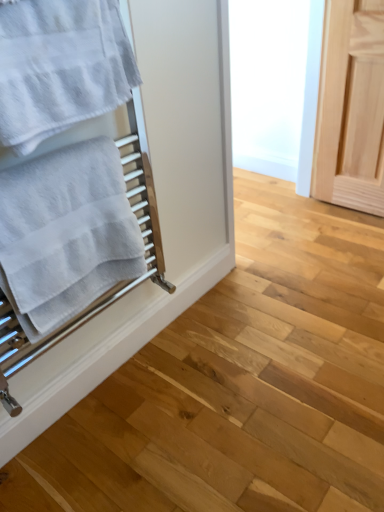
Question: Would you say white cotton towel at left, which is the 1th towel in bottom-to-top order, is inside or outside white textured towel at left, which ranks as the first towel in top-to-bottom order?

Choices:
 (A) inside
 (B) outside

Answer: (B)

Question: From a real-world perspective, is white cotton towel at left, which is the 1th towel in bottom-to-top order, physically located above or below white textured towel at left, which ranks as the first towel in top-to-bottom order?

Choices:
 (A) below
 (B) above

Answer: (A)

Question: Visually, is white cotton towel at left, which is the 2th towel from top to bottom, positioned to the left or to the right of white textured towel at left, which ranks as the first towel in top-to-bottom order?

Choices:
 (A) left
 (B) right

Answer: (A)

Question: Does point (54, 81) appear closer or farther from the camera than point (24, 242)?

Choices:
 (A) farther
 (B) closer

Answer: (B)

Question: From their relative heights in the image, would you say white textured towel at left, which ranks as the first towel in top-to-bottom order, is taller or shorter than white cotton towel at left, which is the 2th towel from top to bottom?

Choices:
 (A) short
 (B) tall

Answer: (A)

Question: Looking at the image, does white textured towel at left, the 2th towel in the bottom-to-top sequence, seem bigger or smaller compared to white cotton towel at left, which is the 2th towel from top to bottom?

Choices:
 (A) big
 (B) small

Answer: (B)

Question: From a real-world perspective, is white textured towel at left, which ranks as the first towel in top-to-bottom order, positioned above or below white cotton towel at left, which is the 1th towel in bottom-to-top order?

Choices:
 (A) above
 (B) below

Answer: (A)